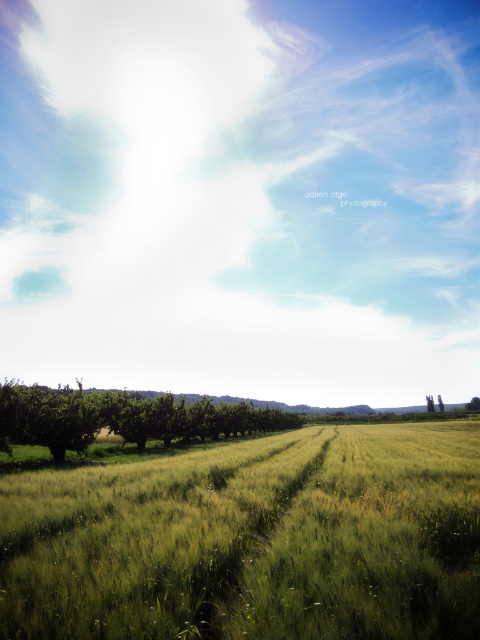
You are standing in the middle of the green grassy wheat field at lower center and want to walk towards the green leafy tree at lower left. Which direction should you head?

The green leafy tree at lower left is behind the green grassy wheat field at lower center, so you should walk towards the lower left direction to reach it.

You are a photographer planning to capture the entire view of the bright white cloud at upper center and the green grassy wheat field at lower center in a single frame. Given that your camera has a fixed field of view, which object would require you to adjust your framing more to ensure both are fully visible?

The bright white cloud at upper center would require more adjustment since its width is greater than the green grassy wheat field at lower center, so you need to widen the frame to accommodate its larger size.

You are standing at the edge of the green grassy wheat field at lower center and want to walk towards the green leafy tree at lower left. Which direction should you go to reach the tree?

The green grassy wheat field at lower center is positioned over the green leafy tree at lower left, meaning the tree is located behind the wheat field. To reach the tree, you should walk towards the direction opposite of where the wheat field is positioned, likely towards the lower left area of the scene.